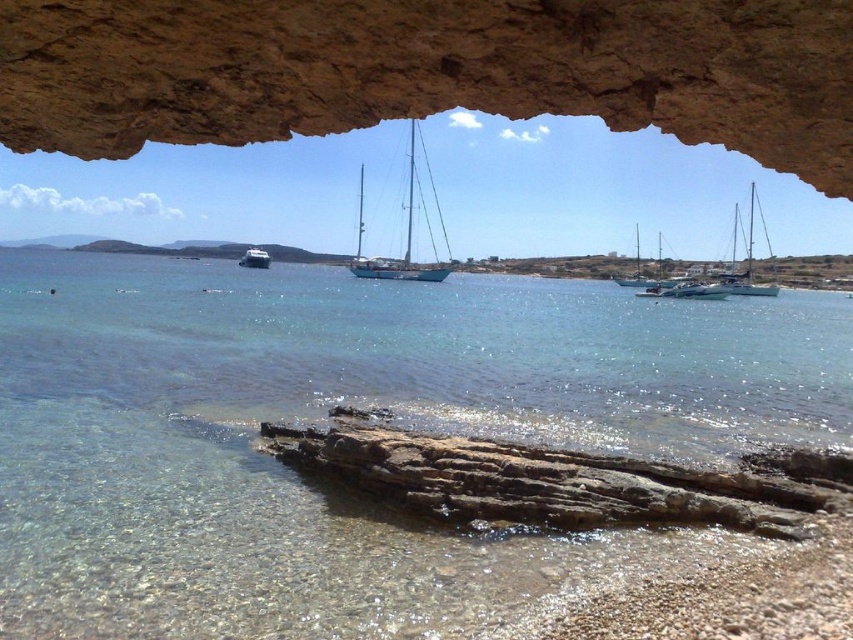
Can you confirm if white matte sailboat at center is positioned below white glossy sailboat at center?

Incorrect, white matte sailboat at center is not positioned below white glossy sailboat at center.

What do you see at coordinates (410, 225) in the screenshot? I see `white matte sailboat at center` at bounding box center [410, 225].

At what (x,y) coordinates should I click in order to perform the action: click on white matte sailboat at center. Please return your answer as a coordinate pair (x, y). Looking at the image, I should click on (410, 225).

Locate an element on the screen. white matte sailboat at center is located at coordinates (410, 225).

What do you see at coordinates (354, 404) in the screenshot?
I see `clear water at lower center` at bounding box center [354, 404].

Locate an element on the screen. This screenshot has width=853, height=640. clear water at lower center is located at coordinates pyautogui.click(x=354, y=404).

The height and width of the screenshot is (640, 853). What do you see at coordinates (354, 404) in the screenshot?
I see `clear water at lower center` at bounding box center [354, 404].

Locate an element on the screen. The image size is (853, 640). clear water at lower center is located at coordinates (354, 404).

Who is more distant from viewer, [430,356] or [428,198]?

The point [428,198] is behind.

Does clear water at lower center appear under white matte sailboat at center?

Yes, clear water at lower center is below white matte sailboat at center.

Is point (245, 516) positioned behind point (436, 259)?

No, (245, 516) is in front of (436, 259).

The height and width of the screenshot is (640, 853). Identify the location of clear water at lower center. (354, 404).